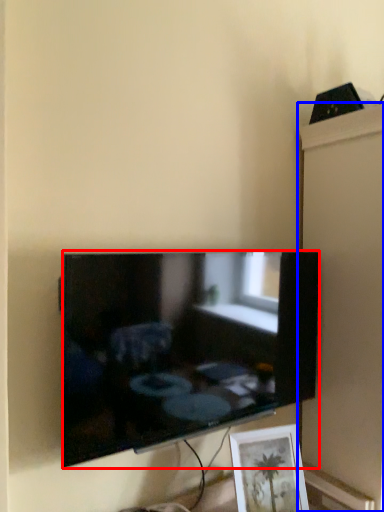
Question: Which of the following is the farthest to the observer, television (highlighted by a red box) or cabinet (highlighted by a blue box)?

Choices:
 (A) television
 (B) cabinet

Answer: (B)